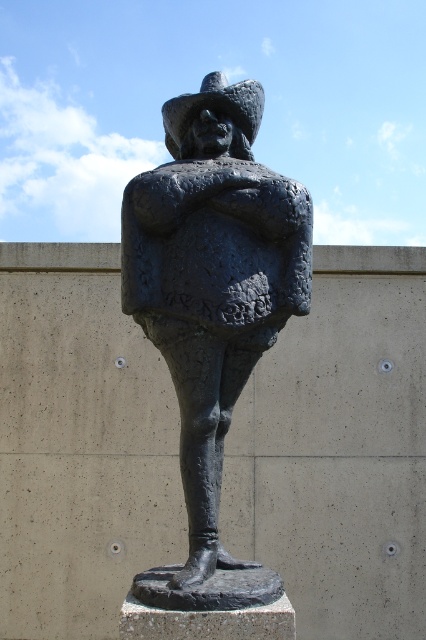
Question: Can you confirm if bronze statue at center is bigger than dark gray textured hat at upper center?

Choices:
 (A) no
 (B) yes

Answer: (B)

Question: Which point is closer to the camera?

Choices:
 (A) bronze statue at center
 (B) dark gray textured hat at upper center

Answer: (A)

Question: Which point is farther to the camera?

Choices:
 (A) (224, 99)
 (B) (212, 525)

Answer: (A)

Question: In this image, where is bronze statue at center located relative to dark gray textured hat at upper center?

Choices:
 (A) left
 (B) right

Answer: (B)

Question: From the image, what is the correct spatial relationship of bronze statue at center in relation to dark gray textured hat at upper center?

Choices:
 (A) below
 (B) above

Answer: (A)

Question: Which of the following is the farthest from the observer?

Choices:
 (A) bronze statue at center
 (B) dark gray textured hat at upper center

Answer: (B)